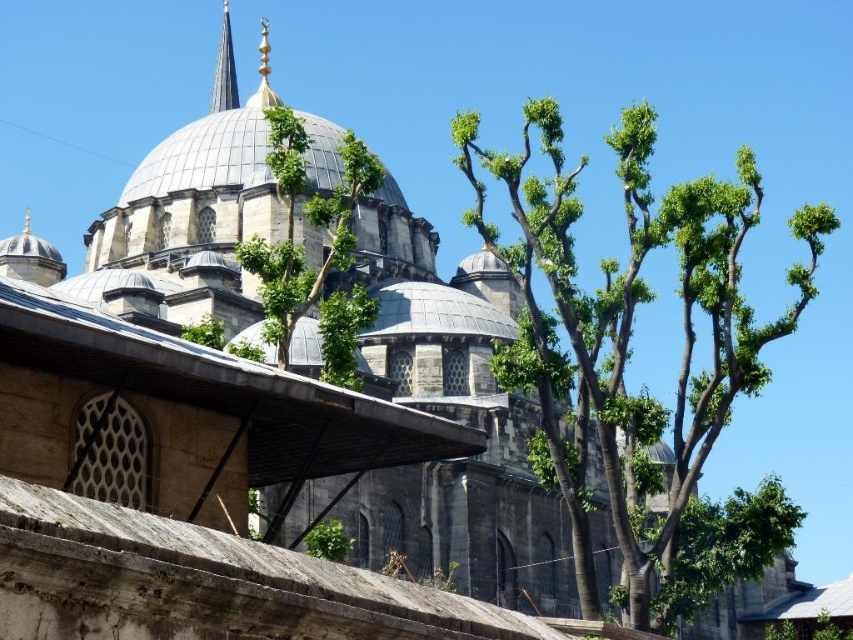
You are a drone operator tasked with capturing aerial footage of the mosque. Your drone has a maximum flight range of 50 meters. If you are currently positioned at the green leafy tree at center, can you safely fly your drone to the shiny silver spire at upper center without exceeding its range?

The green leafy tree at center is 49.26 meters from the shiny silver spire at upper center. Since the drone has a maximum range of 50 meters, it can safely reach the spire as the distance is within the limit.

You are standing in front of the mosque and want to take a photo of the shiny silver spire at upper center without the green leafy tree at center blocking it. What should you do?

Move your position so that you are standing further back from the green leafy tree at center. Since the green leafy tree at center is below the shiny silver spire at upper center, moving back will allow you to see the spire above the tree.

You are an architect planning to install a new lighting system for the mosque. You have two options for the lighting fixtures. The first option is a wide fixture that matches the width of the green leafy tree at center. The second option is a narrow fixture that matches the width of the shiny silver spire at upper center. Which fixture would you choose to ensure it doesn

The green leafy tree at center is wider than the shiny silver spire at upper center. Therefore, the wide fixture matching the green leafy tree at center would be appropriate to ensure it is proportionate to the structure.